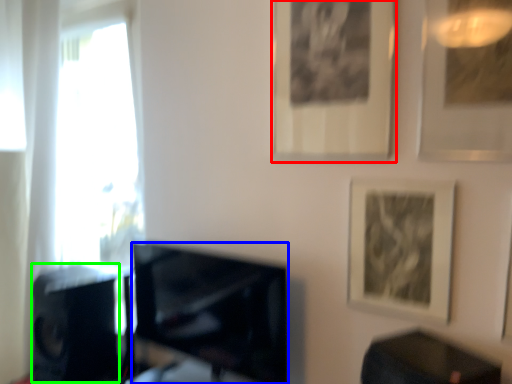
Question: Based on their relative distances, which object is nearer to picture frame (highlighted by a red box)? Choose from television (highlighted by a blue box) and speaker (highlighted by a green box).

Choices:
 (A) television
 (B) speaker

Answer: (A)